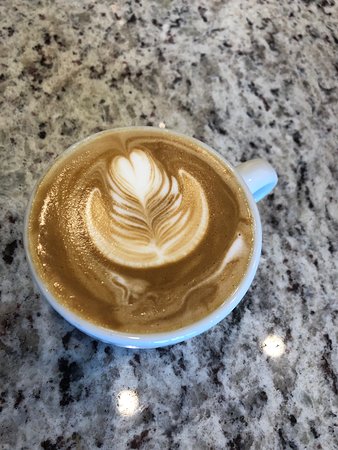
At what (x,y) coordinates should I click in order to perform the action: click on granite counter. Please return your answer as a coordinate pair (x, y). This screenshot has height=450, width=338. Looking at the image, I should click on (69, 64), (229, 77), (301, 189).